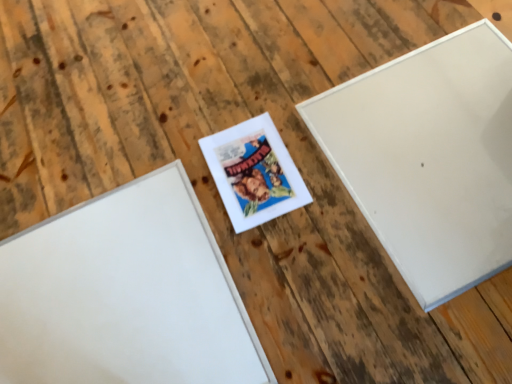
At what (x,y) coordinates should I click in order to perform the action: click on free space to the back side of white matte picture frame at upper right, placed as the third picture frame when sorted from left to right. Please return your answer as a coordinate pair (x, y). Looking at the image, I should click on (338, 37).